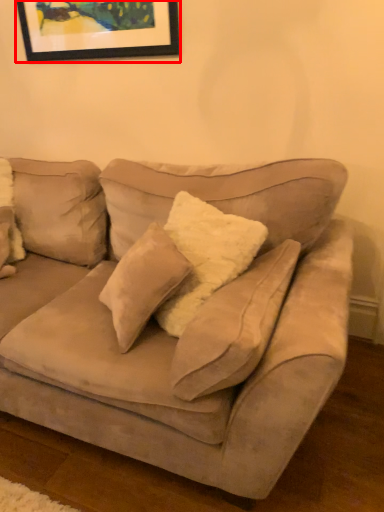
Question: From the image, what is the correct spatial relationship of picture frame (annotated by the red box) in relation to studio couch?

Choices:
 (A) left
 (B) right

Answer: (B)